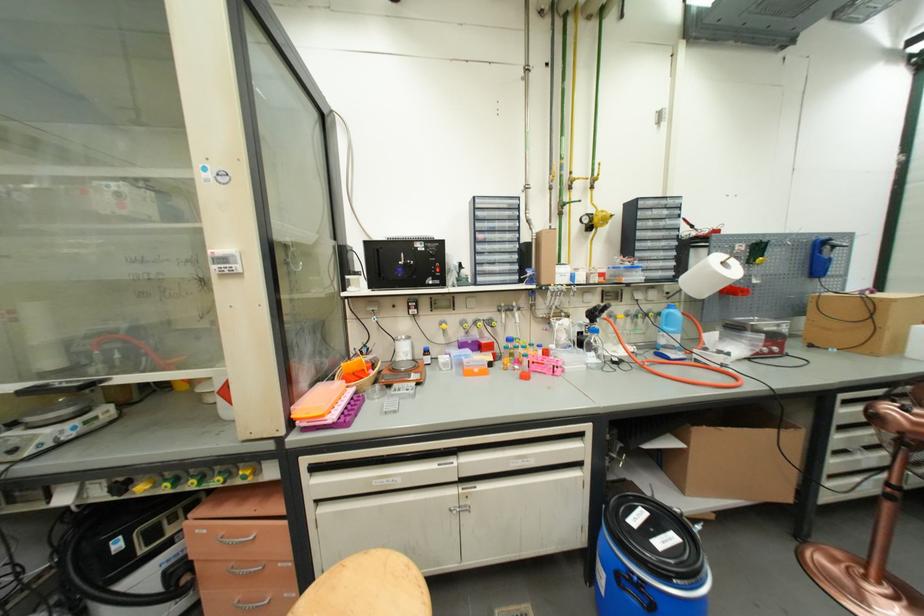
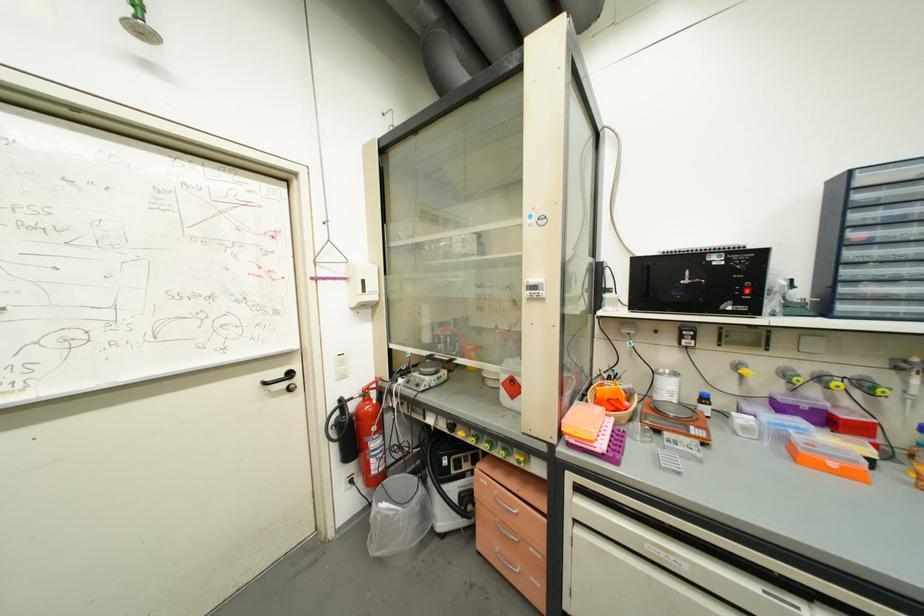
The point at (475, 344) is marked in the first image. Where is the corresponding point in the second image?

(807, 410)